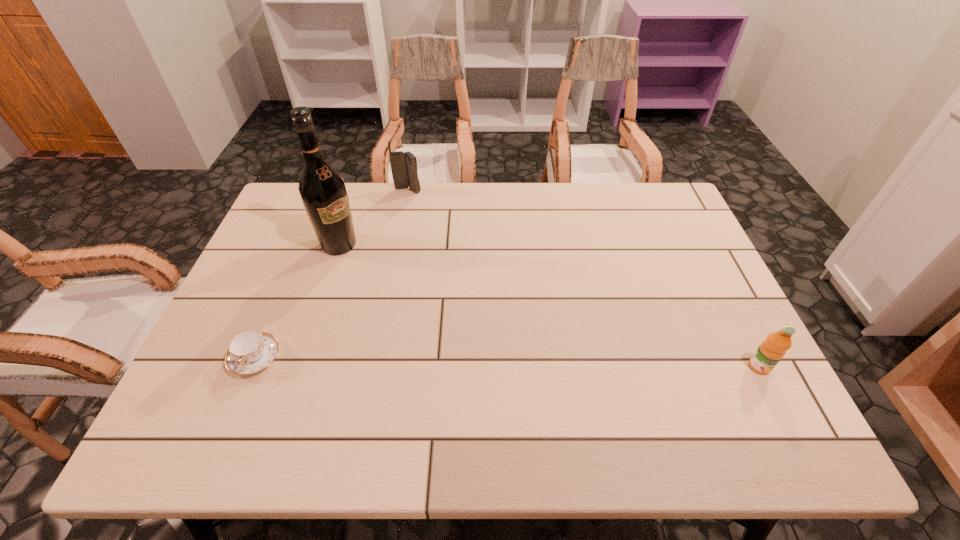
This screenshot has width=960, height=540. In order to click on object situated at the near right corner in this screenshot , I will do `click(771, 351)`.

Where is `vacant space at the far edge of the desktop`? Image resolution: width=960 pixels, height=540 pixels. vacant space at the far edge of the desktop is located at coordinates (416, 217).

Identify the location of vacant space at the left edge of the desktop. (302, 235).

In order to click on free location at the right edge of the desktop in this screenshot , I will do `click(722, 303)`.

Where is `vacant region at the far left corner`? vacant region at the far left corner is located at coordinates (297, 218).

Where is `free location at the near left corner`? free location at the near left corner is located at coordinates (194, 393).

In the image, there is a desktop. Identify the location of vacant space at the far right corner. This screenshot has height=540, width=960. (629, 184).

Image resolution: width=960 pixels, height=540 pixels. Find the location of `free space between the teacup and the second farthest object`. free space between the teacup and the second farthest object is located at coordinates (298, 301).

You are a GUI agent. You are given a task and a screenshot of the screen. Output one action in this format:
    pyautogui.click(x=<x>, y=<y>)
    Task: Click on the vacant space that is in between the second object from right to left and the teacup
    The height and width of the screenshot is (540, 960).
    Given the screenshot: What is the action you would take?
    pyautogui.click(x=331, y=274)

Where is `vacant region between the farthest object and the rightmost object`? The width and height of the screenshot is (960, 540). vacant region between the farthest object and the rightmost object is located at coordinates (584, 279).